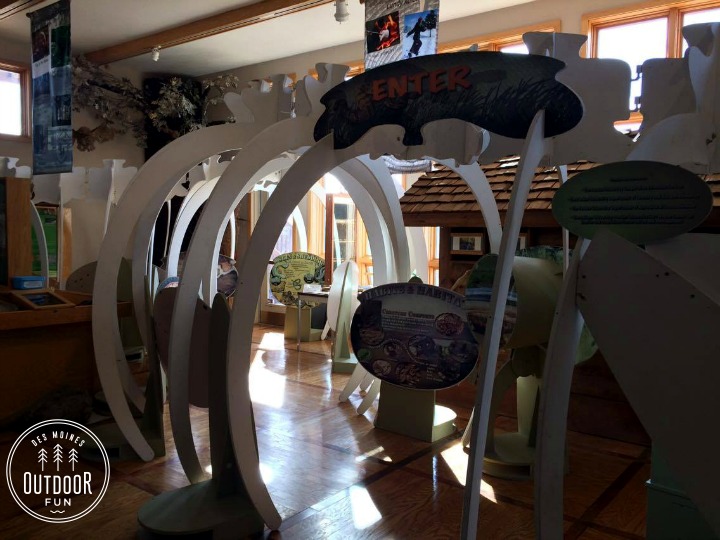
Identify the location of hanging banner. The height and width of the screenshot is (540, 720). (58, 52).